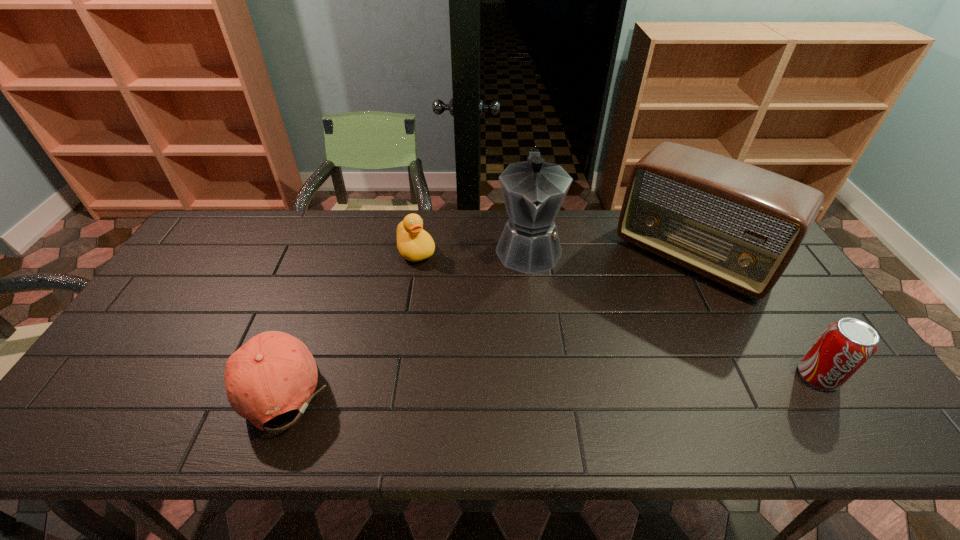
This screenshot has height=540, width=960. I want to click on free space located at the spout of the third object from left to right, so click(533, 355).

Where is `free spot located at the spout of the third object from left to right`? free spot located at the spout of the third object from left to right is located at coordinates click(x=534, y=372).

The height and width of the screenshot is (540, 960). In order to click on vacant space located 0.360m on the front-facing side of the radio receiver in this screenshot , I will do `click(594, 377)`.

Identify the location of vacant point located 0.070m on the front-facing side of the radio receiver. (648, 309).

Where is `blank space located on the front-facing side of the radio receiver`? The image size is (960, 540). blank space located on the front-facing side of the radio receiver is located at coordinates (639, 320).

Locate an element on the screen. The image size is (960, 540). vacant region located 0.380m on the face of the fourth object from right to left is located at coordinates (475, 356).

Where is `vacant area situated on the face of the fourth object from right to left`? vacant area situated on the face of the fourth object from right to left is located at coordinates (452, 316).

The height and width of the screenshot is (540, 960). Identify the location of vacant position located 0.260m on the face of the fourth object from right to left. (456, 323).

Identify the location of coffeepot that is at the far edge. This screenshot has width=960, height=540. (x=534, y=190).

Where is `radio receiver present at the far edge`? The image size is (960, 540). radio receiver present at the far edge is located at coordinates (740, 225).